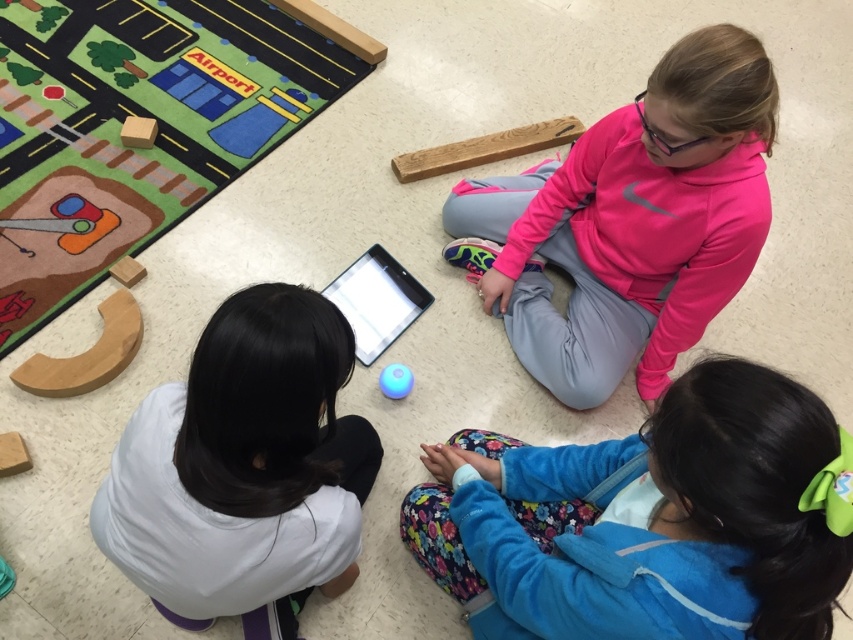
Can you confirm if pink fleece sweatshirt at upper right is taller than white matte shirt at center?

Yes.

Can you confirm if pink fleece sweatshirt at upper right is positioned to the left of white matte shirt at center?

In fact, pink fleece sweatshirt at upper right is to the right of white matte shirt at center.

What do you see at coordinates (634, 221) in the screenshot? I see `pink fleece sweatshirt at upper right` at bounding box center [634, 221].

This screenshot has height=640, width=853. In order to click on pink fleece sweatshirt at upper right in this screenshot , I will do `click(634, 221)`.

Can you confirm if blue fleece jacket at lower right is taller than white matte shirt at center?

No.

Is point (773, 426) farther from camera compared to point (341, 572)?

No.

Locate an element on the screen. This screenshot has height=640, width=853. blue fleece jacket at lower right is located at coordinates (646, 520).

Between white matte shirt at center and blue rubber ball at center, which one appears on the right side from the viewer's perspective?

From the viewer's perspective, blue rubber ball at center appears more on the right side.

Based on the photo, who is lower down, white matte shirt at center or blue rubber ball at center?

white matte shirt at center

Is point (140, 413) closer to camera compared to point (387, 374)?

Yes.

This screenshot has width=853, height=640. I want to click on white matte shirt at center, so click(244, 468).